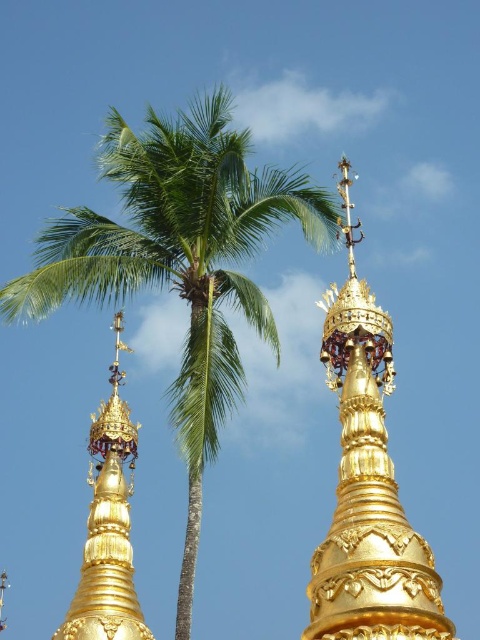
You are a photographer planning to capture a photo of the gold polished stupa at upper center and the green leafy palm tree at left. If you want to ensure both are fully visible in the frame without any part being cut off, which object should you position closer to the camera?

The green leafy palm tree at left is taller than the gold polished stupa at upper center. To ensure both are fully visible, position the green leafy palm tree at left closer to the camera so its height fits within the frame while the shorter stupa can also be captured without cropping.